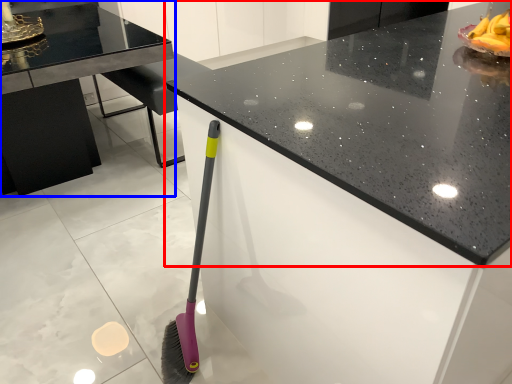
Question: Which object is closer to the camera taking this photo, countertop (highlighted by a red box) or table (highlighted by a blue box)?

Choices:
 (A) countertop
 (B) table

Answer: (A)